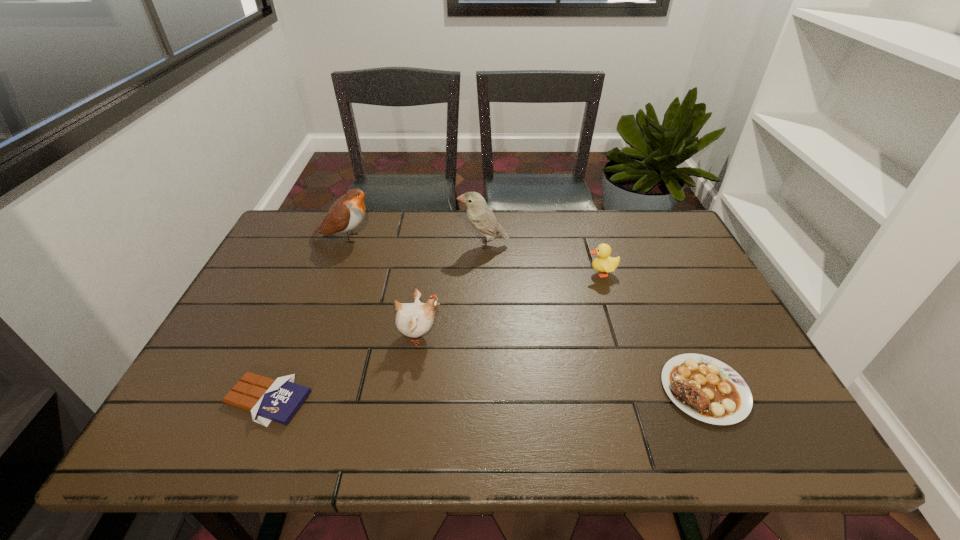
Where is `chocolate bar located in the near edge section of the desktop`? This screenshot has width=960, height=540. chocolate bar located in the near edge section of the desktop is located at coordinates (267, 399).

Locate an element on the screen. This screenshot has height=540, width=960. bird present at the left edge is located at coordinates (346, 213).

Where is `chocolate bar positioned at the left edge`? This screenshot has width=960, height=540. chocolate bar positioned at the left edge is located at coordinates (267, 399).

Find the location of a particular element. The image size is (960, 540). object located in the right edge section of the desktop is located at coordinates (705, 388).

Image resolution: width=960 pixels, height=540 pixels. I want to click on object that is positioned at the far left corner, so (x=346, y=213).

You are a GUI agent. You are given a task and a screenshot of the screen. Output one action in this format:
    pyautogui.click(x=<x>, y=<y>)
    Task: Click on the object located at the near left corner
    
    Given the screenshot: What is the action you would take?
    pyautogui.click(x=267, y=399)

At what (x,y) coordinates should I click in order to perform the action: click on object that is positioned at the near right corner. Please return your answer as a coordinate pair (x, y). Looking at the image, I should click on (705, 388).

Locate an element on the screen. free space at the far edge of the desktop is located at coordinates (591, 222).

Locate an element on the screen. The height and width of the screenshot is (540, 960). vacant area at the near edge of the desktop is located at coordinates (363, 427).

At what (x,y) coordinates should I click in order to perform the action: click on vacant space at the left edge of the desktop. Please return your answer as a coordinate pair (x, y). Looking at the image, I should click on (223, 342).